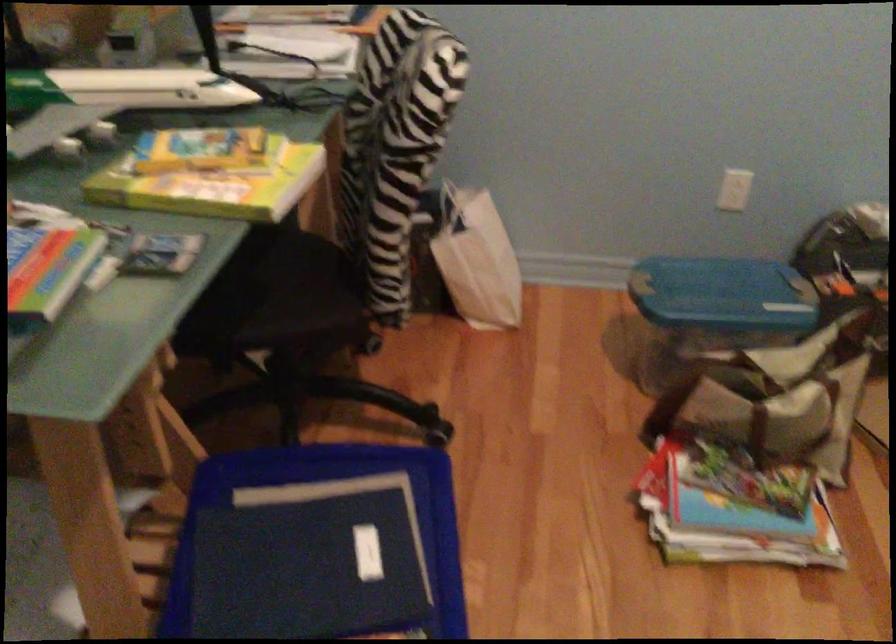
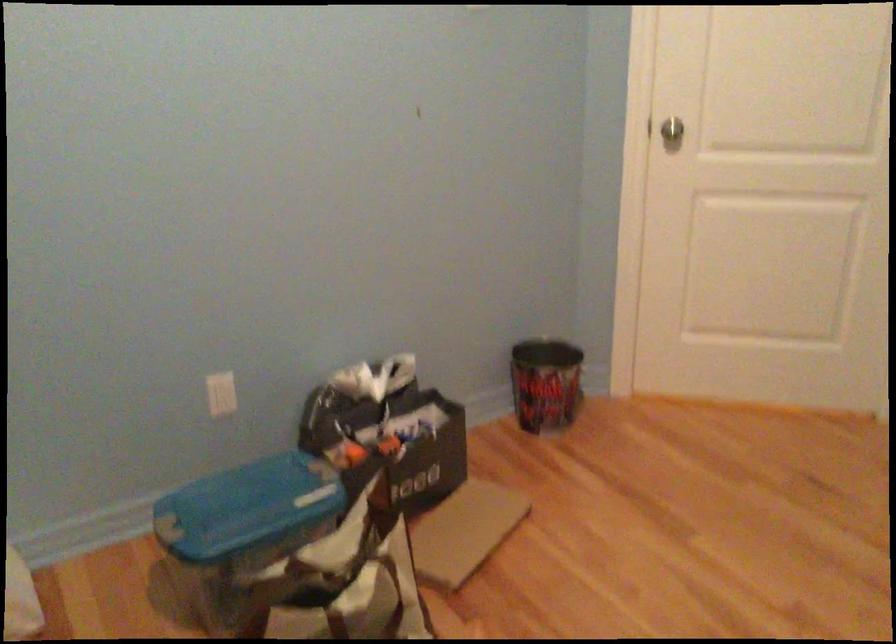
The point at (738, 184) is marked in the first image. Where is the corresponding point in the second image?

(220, 393)